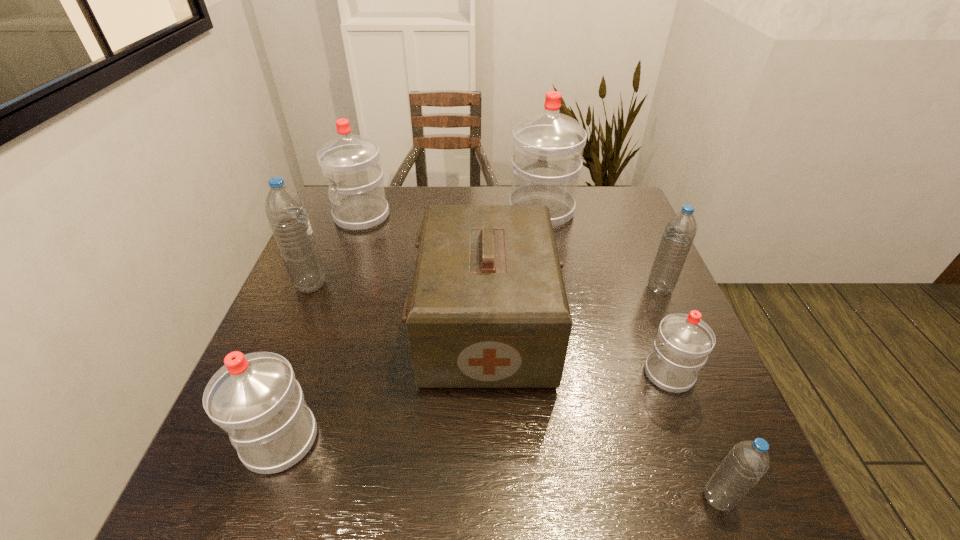
You are a GUI agent. You are given a task and a screenshot of the screen. Output one action in this format:
    pyautogui.click(x=<x>, y=<y>)
    Task: Click on the nearest water bottle
    This screenshot has height=540, width=960.
    Given the screenshot: What is the action you would take?
    pyautogui.click(x=746, y=463)

At what (x,y) coordinates should I click in order to perform the action: click on the smallest blue water bottle. Please return your answer as a coordinate pair (x, y). Image resolution: width=960 pixels, height=540 pixels. Looking at the image, I should click on (746, 463).

Identify the location of free location located 0.270m on the front of the biggest blue water bottle. Image resolution: width=960 pixels, height=540 pixels. click(x=267, y=390).

Find the location of `free location located 0.250m on the back of the red first-aid kit`. free location located 0.250m on the back of the red first-aid kit is located at coordinates coord(485,220).

I want to click on free space located on the left of the second biggest blue water bottle, so click(x=583, y=288).

The height and width of the screenshot is (540, 960). I want to click on vacant region located 0.360m on the handle side of the fifth farthest water bottle, so click(x=622, y=250).

I want to click on vacant space located 0.330m on the handle side of the fifth farthest water bottle, so click(624, 257).

You are a GUI agent. You are given a task and a screenshot of the screen. Output one action in this format:
    pyautogui.click(x=<x>, y=<y>)
    Task: Click on the blank space located 0.260m on the handle side of the fifth farthest water bottle
    The image size is (960, 540).
    Given the screenshot: What is the action you would take?
    pyautogui.click(x=631, y=274)

Locate an element on the screen. Image resolution: width=960 pixels, height=540 pixels. vacant space situated on the back of the nearest object is located at coordinates (667, 367).

You are a GUI agent. You are given a task and a screenshot of the screen. Output one action in this format:
    pyautogui.click(x=<x>, y=<y>)
    Task: Click on the object that is positioned at the far left corner
    Image resolution: width=960 pixels, height=540 pixels.
    Given the screenshot: What is the action you would take?
    pyautogui.click(x=351, y=163)